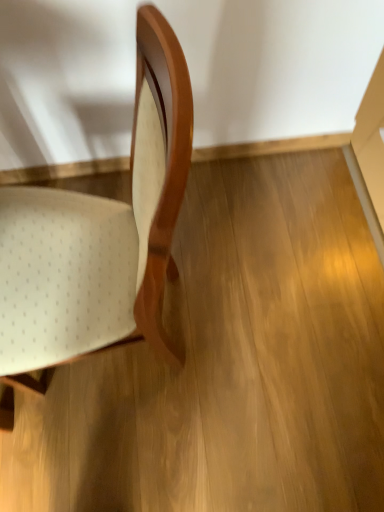
Where is `vacant space to the right of matte white chair at left`? Image resolution: width=384 pixels, height=512 pixels. vacant space to the right of matte white chair at left is located at coordinates tap(251, 325).